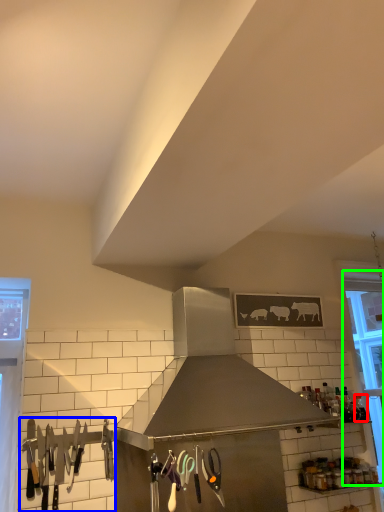
Question: Based on their relative distances, which object is nearer to bottle (highlighted by a red box)? Choose from silverware (highlighted by a blue box) and window (highlighted by a green box).

Choices:
 (A) silverware
 (B) window

Answer: (B)